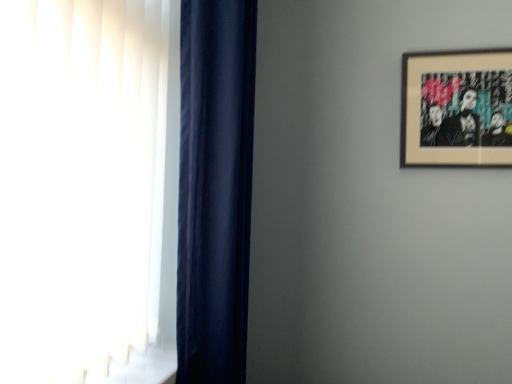
Question: From a real-world perspective, is navy velvet curtain at left located beneath wooden-framed artwork at upper right?

Choices:
 (A) yes
 (B) no

Answer: (A)

Question: Is navy velvet curtain at left at the right side of wooden-framed artwork at upper right?

Choices:
 (A) no
 (B) yes

Answer: (A)

Question: From the image's perspective, is navy velvet curtain at left located above wooden-framed artwork at upper right?

Choices:
 (A) no
 (B) yes

Answer: (A)

Question: Is navy velvet curtain at left to the left of wooden-framed artwork at upper right from the viewer's perspective?

Choices:
 (A) no
 (B) yes

Answer: (B)

Question: Considering the relative positions of navy velvet curtain at left and wooden-framed artwork at upper right in the image provided, is navy velvet curtain at left behind wooden-framed artwork at upper right?

Choices:
 (A) no
 (B) yes

Answer: (A)

Question: Is navy velvet curtain at left outside wooden-framed artwork at upper right?

Choices:
 (A) no
 (B) yes

Answer: (B)

Question: From the image's perspective, is wooden-framed artwork at upper right above navy velvet curtain at left?

Choices:
 (A) yes
 (B) no

Answer: (A)

Question: Is wooden-framed artwork at upper right located outside navy velvet curtain at left?

Choices:
 (A) no
 (B) yes

Answer: (B)

Question: Does wooden-framed artwork at upper right appear on the right side of navy velvet curtain at left?

Choices:
 (A) no
 (B) yes

Answer: (B)

Question: From the image's perspective, is wooden-framed artwork at upper right under navy velvet curtain at left?

Choices:
 (A) yes
 (B) no

Answer: (B)

Question: Considering the relative sizes of wooden-framed artwork at upper right and navy velvet curtain at left in the image provided, is wooden-framed artwork at upper right thinner than navy velvet curtain at left?

Choices:
 (A) yes
 (B) no

Answer: (A)

Question: Would you say wooden-framed artwork at upper right is a long distance from navy velvet curtain at left?

Choices:
 (A) yes
 (B) no

Answer: (B)

Question: Choose the correct answer: Is wooden-framed artwork at upper right inside navy velvet curtain at left or outside it?

Choices:
 (A) inside
 (B) outside

Answer: (B)